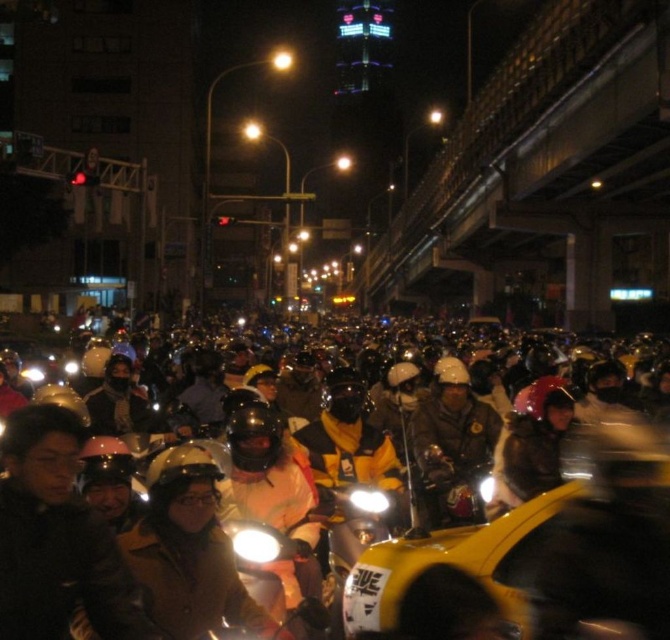
Question: Which of these objects is positioned closest to the matte white headlight at center?

Choices:
 (A) metallic silver motorcycle at center
 (B) white glossy headlight at center

Answer: (B)

Question: Which point is farther to the camera?

Choices:
 (A) (263, 556)
 (B) (387, 500)
 (C) (469, 461)

Answer: (C)

Question: Is metallic silver motorcycle at center wider than matte white headlight at center?

Choices:
 (A) no
 (B) yes

Answer: (B)

Question: Considering the relative positions of metallic silver motorcycle at center and white glossy headlight at center in the image provided, where is metallic silver motorcycle at center located with respect to white glossy headlight at center?

Choices:
 (A) left
 (B) right

Answer: (B)

Question: Which of the following is the closest to the observer?

Choices:
 (A) matte white headlight at center
 (B) metallic silver motorcycle at center
 (C) white glossy headlight at center

Answer: (C)

Question: Observing the image, what is the correct spatial positioning of white glossy headlight at center in reference to matte white headlight at center?

Choices:
 (A) below
 (B) above

Answer: (A)